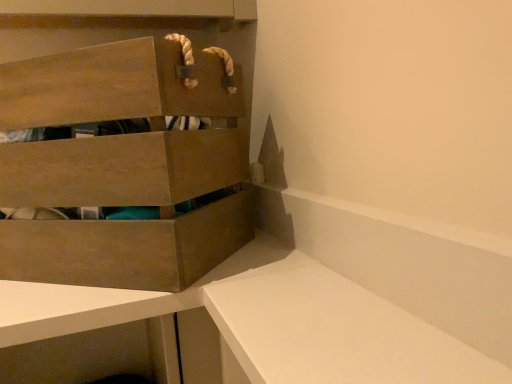
Question: From a real-world perspective, is white matte vanity at lower right on wooden crate at upper left?

Choices:
 (A) yes
 (B) no

Answer: (B)

Question: From a real-world perspective, is white matte vanity at lower right beneath wooden crate at upper left?

Choices:
 (A) no
 (B) yes

Answer: (B)

Question: Would you say white matte vanity at lower right is a long distance from wooden crate at upper left?

Choices:
 (A) yes
 (B) no

Answer: (B)

Question: Is white matte vanity at lower right next to wooden crate at upper left and touching it?

Choices:
 (A) no
 (B) yes

Answer: (A)

Question: Is the position of white matte vanity at lower right less distant than that of wooden crate at upper left?

Choices:
 (A) yes
 (B) no

Answer: (A)

Question: Does white matte vanity at lower right turn towards wooden crate at upper left?

Choices:
 (A) yes
 (B) no

Answer: (A)

Question: Is wooden crate at upper left not close to white matte vanity at lower right?

Choices:
 (A) yes
 (B) no

Answer: (B)

Question: Is wooden crate at upper left not within white matte vanity at lower right?

Choices:
 (A) no
 (B) yes

Answer: (B)

Question: Considering the relative positions of wooden crate at upper left and white matte vanity at lower right in the image provided, is wooden crate at upper left to the right of white matte vanity at lower right from the viewer's perspective?

Choices:
 (A) yes
 (B) no

Answer: (B)

Question: Considering the relative sizes of wooden crate at upper left and white matte vanity at lower right in the image provided, is wooden crate at upper left thinner than white matte vanity at lower right?

Choices:
 (A) no
 (B) yes

Answer: (A)

Question: Is wooden crate at upper left to the left of white matte vanity at lower right from the viewer's perspective?

Choices:
 (A) yes
 (B) no

Answer: (A)

Question: From a real-world perspective, is wooden crate at upper left located beneath white matte vanity at lower right?

Choices:
 (A) no
 (B) yes

Answer: (A)

Question: Is wooden crate at upper left bigger or smaller than white matte vanity at lower right?

Choices:
 (A) big
 (B) small

Answer: (A)